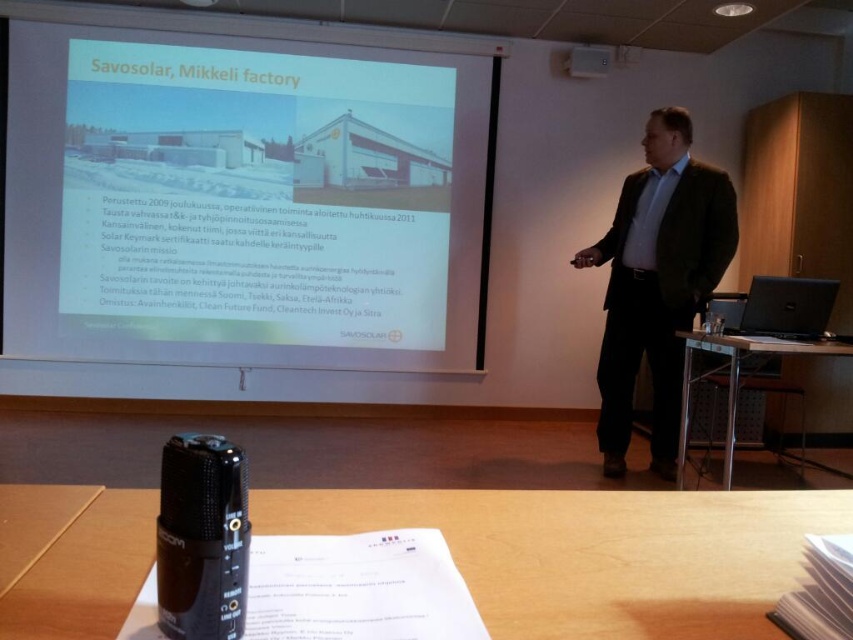
From the picture: Does white matte projector screen at upper center appear over wooden table at lower center?

Indeed, white matte projector screen at upper center is positioned over wooden table at lower center.

Who is more distant from viewer, (187, 124) or (495, 560)?

Point (187, 124)

Measure the distance between white matte projector screen at upper center and camera.

A distance of 4.40 meters exists between white matte projector screen at upper center and camera.

The image size is (853, 640). I want to click on white matte projector screen at upper center, so click(248, 195).

Looking at this image, does metallic silver table at lower right have a greater height compared to matte black projector at upper center?

Indeed, metallic silver table at lower right has a greater height compared to matte black projector at upper center.

Is metallic silver table at lower right positioned behind matte black projector at upper center?

No, metallic silver table at lower right is closer to the viewer.

Image resolution: width=853 pixels, height=640 pixels. What are the coordinates of `metallic silver table at lower right` in the screenshot? It's located at (735, 380).

Is green matte suit at center to the right of matte black projector at upper center from the viewer's perspective?

Indeed, green matte suit at center is positioned on the right side of matte black projector at upper center.

Based on the photo, can you confirm if green matte suit at center is smaller than matte black projector at upper center?

Incorrect, green matte suit at center is not smaller in size than matte black projector at upper center.

Image resolution: width=853 pixels, height=640 pixels. Identify the location of green matte suit at center. (657, 282).